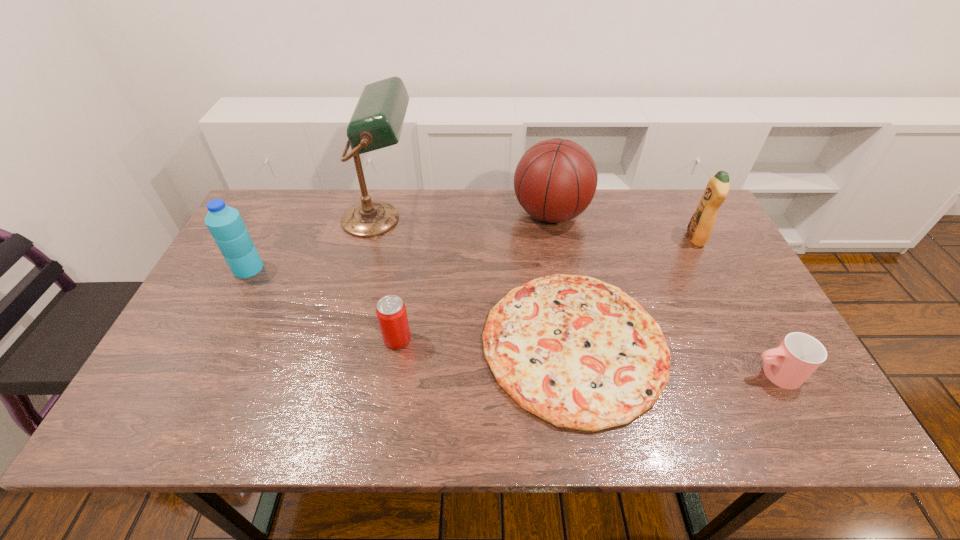
You are a GUI agent. You are given a task and a screenshot of the screen. Output one action in this format:
    pyautogui.click(x=<x>, y=<y>)
    Task: Click on the detergent located at the far edge
    
    Given the screenshot: What is the action you would take?
    pyautogui.click(x=699, y=229)

Where is `object located at the near edge`? The height and width of the screenshot is (540, 960). object located at the near edge is located at coordinates (580, 353).

This screenshot has height=540, width=960. I want to click on object present at the left edge, so (225, 224).

At what (x,y) coordinates should I click in order to perform the action: click on detergent located at the right edge. Please return your answer as a coordinate pair (x, y). Looking at the image, I should click on (699, 229).

I want to click on cup situated at the right edge, so click(x=790, y=364).

Identify the location of object that is at the far right corner. Image resolution: width=960 pixels, height=540 pixels. (699, 229).

This screenshot has height=540, width=960. Find the location of `free location at the far edge of the desktop`. free location at the far edge of the desktop is located at coordinates (446, 221).

The image size is (960, 540). In the image, there is a desktop. Find the location of `vacant space at the near edge`. vacant space at the near edge is located at coordinates (725, 426).

In the image, there is a desktop. At what (x,y) coordinates should I click in order to perform the action: click on vacant space at the right edge. Please return your answer as a coordinate pair (x, y). Image resolution: width=960 pixels, height=540 pixels. Looking at the image, I should click on pyautogui.click(x=710, y=283).

This screenshot has height=540, width=960. Find the location of `vacant region at the near left corner of the desktop`. vacant region at the near left corner of the desktop is located at coordinates (186, 431).